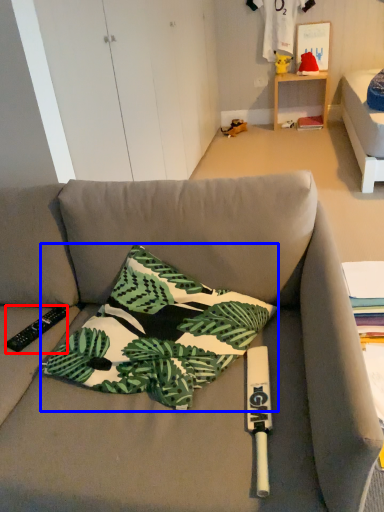
Question: Which of the following is the farthest to the observer, remote control (highlighted by a red box) or pillow (highlighted by a blue box)?

Choices:
 (A) remote control
 (B) pillow

Answer: (A)